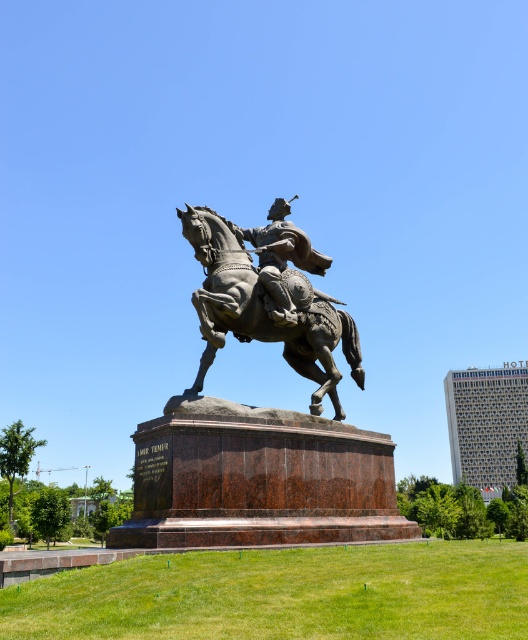
Between bronze statue at center and bronze helmet at center, which one has less height?

With less height is bronze helmet at center.

Based on the photo, who is higher up, bronze statue at center or bronze helmet at center?

bronze helmet at center is higher up.

The width and height of the screenshot is (528, 640). What do you see at coordinates (259, 429) in the screenshot?
I see `bronze statue at center` at bounding box center [259, 429].

This screenshot has height=640, width=528. Find the location of `bronze statue at center`. bronze statue at center is located at coordinates (x=259, y=429).

Does bronze textured horse at center have a larger size compared to bronze helmet at center?

Yes, bronze textured horse at center is bigger than bronze helmet at center.

The width and height of the screenshot is (528, 640). Identify the location of bronze textured horse at center. (264, 310).

At what (x,y) coordinates should I click in order to perform the action: click on bronze textured horse at center. Please return your answer as a coordinate pair (x, y). This screenshot has height=640, width=528. Looking at the image, I should click on (264, 310).

Which is below, bronze statue at center or bronze textured horse at center?

Positioned lower is bronze statue at center.

Is point (346, 454) farther from camera compared to point (262, 307)?

No, it is not.

You are a GUI agent. You are given a task and a screenshot of the screen. Output one action in this format:
    pyautogui.click(x=<x>, y=<y>)
    Task: Click on the bronze statue at center
    This screenshot has width=528, height=640.
    Given the screenshot: What is the action you would take?
    pyautogui.click(x=259, y=429)